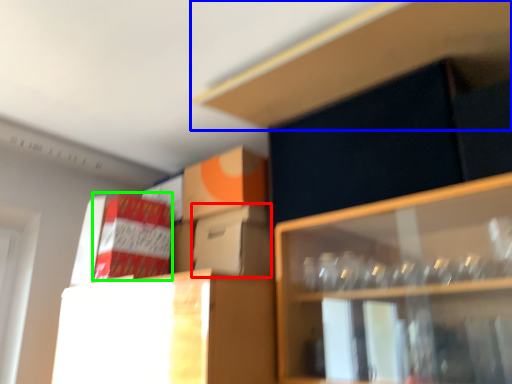
Question: Which object is positioned closest to cardboard box (highlighted by a red box)? Select from cabinet (highlighted by a blue box) and cardboard box (highlighted by a green box).

Choices:
 (A) cabinet
 (B) cardboard box

Answer: (B)